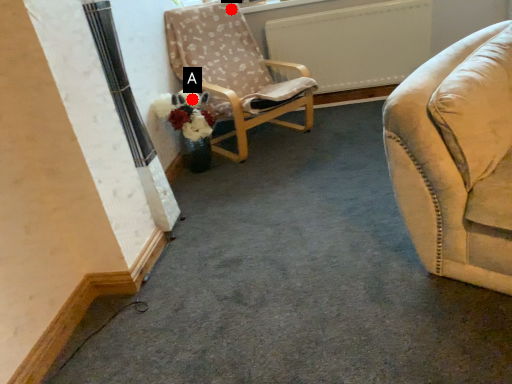
Question: Two points are circled on the image, labeled by A and B beside each circle. Which point is farther to the camera?

Choices:
 (A) A is further
 (B) B is further

Answer: (B)